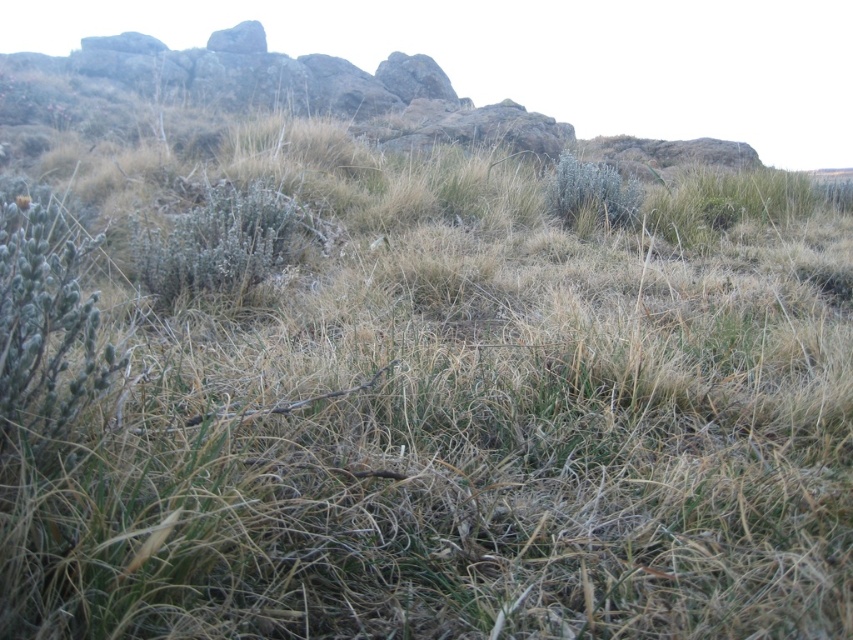
Question: Does fuzzy gray bush at center appear over silvery-green shrub at upper right?

Choices:
 (A) no
 (B) yes

Answer: (A)

Question: Which point is closer to the camera?

Choices:
 (A) (573, 172)
 (B) (196, 284)

Answer: (B)

Question: Where is fuzzy gray bush at center located in relation to silvery-green shrub at upper right in the image?

Choices:
 (A) left
 (B) right

Answer: (A)

Question: Is fuzzy gray bush at center closer to camera compared to silvery-green shrub at upper right?

Choices:
 (A) yes
 (B) no

Answer: (A)

Question: Which object appears farthest from the camera in this image?

Choices:
 (A) fuzzy gray bush at center
 (B) silvery-green shrub at upper right

Answer: (B)